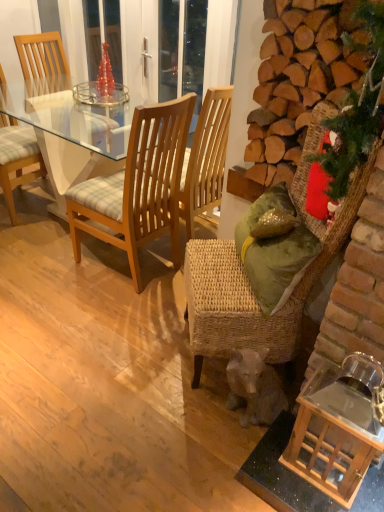
Image resolution: width=384 pixels, height=512 pixels. I want to click on vacant space underneath woodenchair at left, acting as the second chair starting from the right (from a real-world perspective), so pos(140,275).